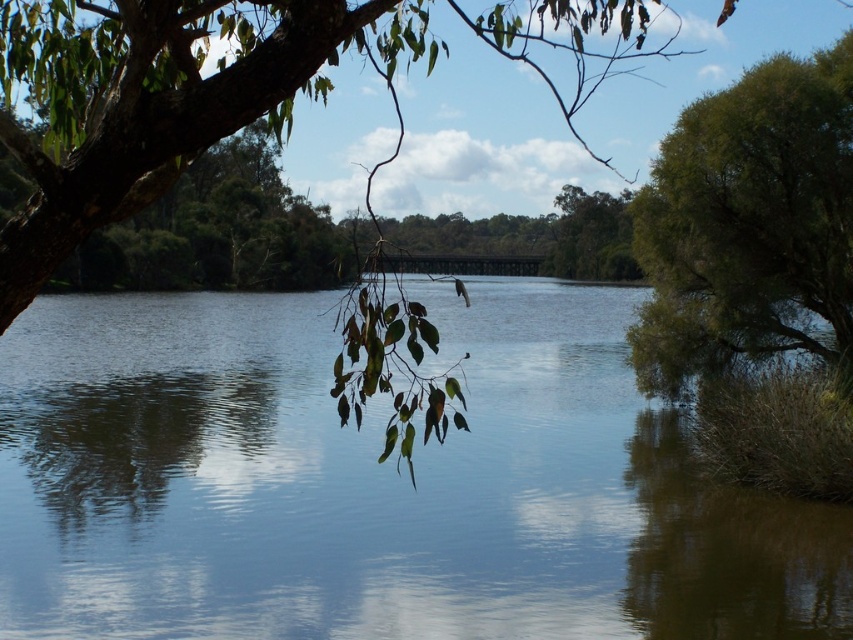
Question: Can you confirm if clear water at center is positioned above green leafy bush at right?

Choices:
 (A) no
 (B) yes

Answer: (A)

Question: Does green leafy branch at upper left appear under green leafy bush at right?

Choices:
 (A) yes
 (B) no

Answer: (B)

Question: Which point appears closest to the camera in this image?

Choices:
 (A) (13, 99)
 (B) (769, 234)
 (C) (610, 536)

Answer: (C)

Question: Does clear water at center come in front of green leafy branch at upper left?

Choices:
 (A) yes
 (B) no

Answer: (B)

Question: Among these points, which one is nearest to the camera?

Choices:
 (A) 67,536
 (B) 833,76

Answer: (A)

Question: Based on their relative distances, which object is nearer to the green leafy bush at right?

Choices:
 (A) green leafy branch at upper left
 (B) clear water at center

Answer: (A)